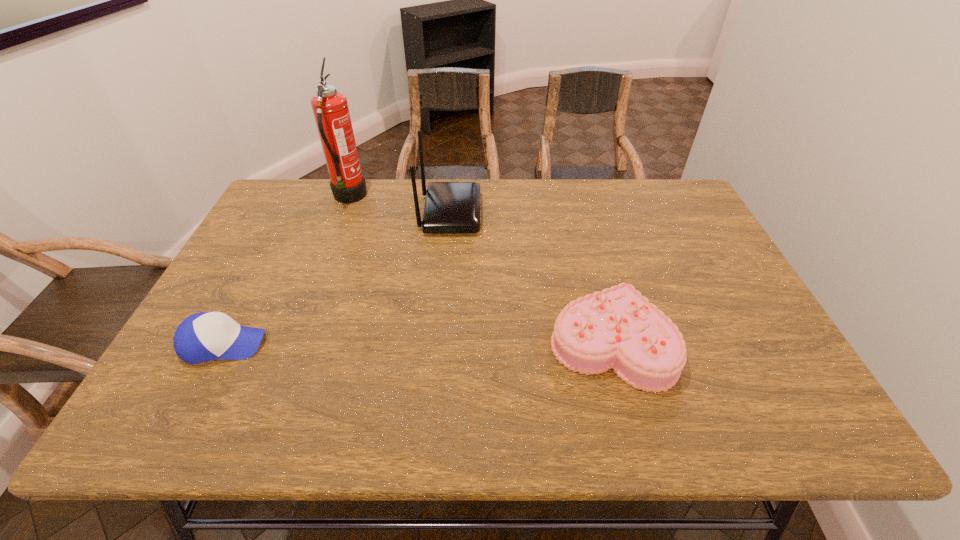
Image resolution: width=960 pixels, height=540 pixels. I want to click on free space between the tallest object and the cake, so click(x=480, y=270).

This screenshot has width=960, height=540. Identify the location of vacant space in between the rightmost object and the fire extinguisher. pyautogui.click(x=480, y=270).

Where is `empty space that is in between the third object from left to right and the rightmost object`? The width and height of the screenshot is (960, 540). empty space that is in between the third object from left to right and the rightmost object is located at coordinates (531, 278).

Find the location of a particular element. vacant area that lies between the tallest object and the rightmost object is located at coordinates (480, 270).

Where is `vacant region between the second tallest object and the baseball cap`? vacant region between the second tallest object and the baseball cap is located at coordinates (337, 279).

Find the location of a particular element. This screenshot has width=960, height=540. free area in between the router and the baseball cap is located at coordinates 337,279.

Where is `free space that is in between the baseball cap and the second tallest object`? The image size is (960, 540). free space that is in between the baseball cap and the second tallest object is located at coordinates (337, 279).

Find the location of a particular element. vacant space in between the cake and the leftmost object is located at coordinates (418, 343).

This screenshot has width=960, height=540. I want to click on vacant region between the fire extinguisher and the third shortest object, so click(399, 206).

Choose which object is the nearest neighbor to the baseball cap. Please provide its 2D coordinates. Your answer should be formatted as a tuple, i.e. [(x, y)], where the tuple contains the x and y coordinates of a point satisfying the conditions above.

[(330, 108)]